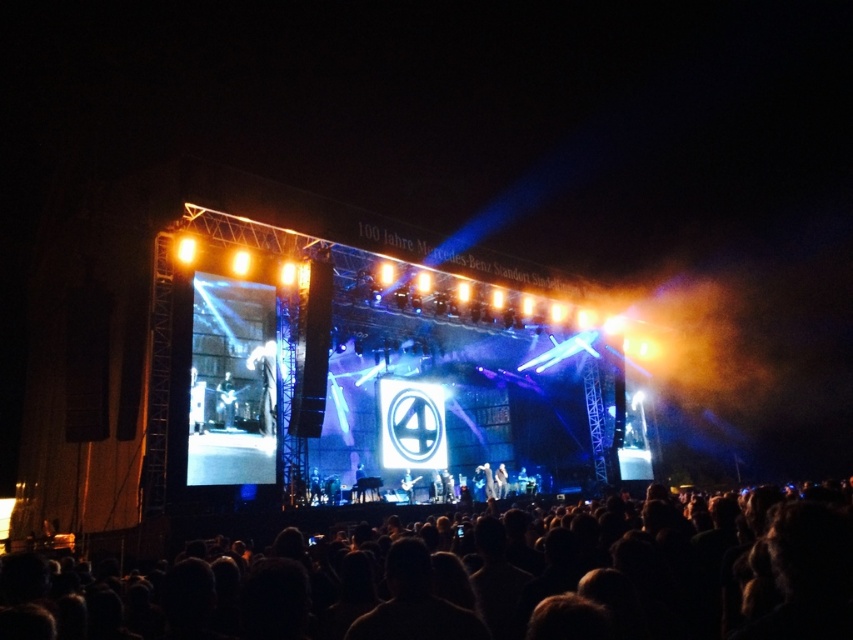
Question: Is black matte crowd at lower center smaller than dark fabric jacket at center?

Choices:
 (A) yes
 (B) no

Answer: (B)

Question: Which of the following is the farthest from the observer?

Choices:
 (A) shiny black guitar at center
 (B) dark fabric jacket at center
 (C) black matte crowd at lower center

Answer: (B)

Question: Where is dark fabric jacket at center located in relation to shiny black guitar at center in the image?

Choices:
 (A) above
 (B) below

Answer: (A)

Question: In this image, where is black matte crowd at lower center located relative to dark fabric jacket at center?

Choices:
 (A) above
 (B) below

Answer: (B)

Question: Which of these objects is positioned closest to the black matte crowd at lower center?

Choices:
 (A) shiny black guitar at center
 (B) dark fabric jacket at center

Answer: (A)

Question: Which of the following is the farthest from the observer?

Choices:
 (A) (225, 380)
 (B) (270, 413)
 (C) (724, 550)

Answer: (B)